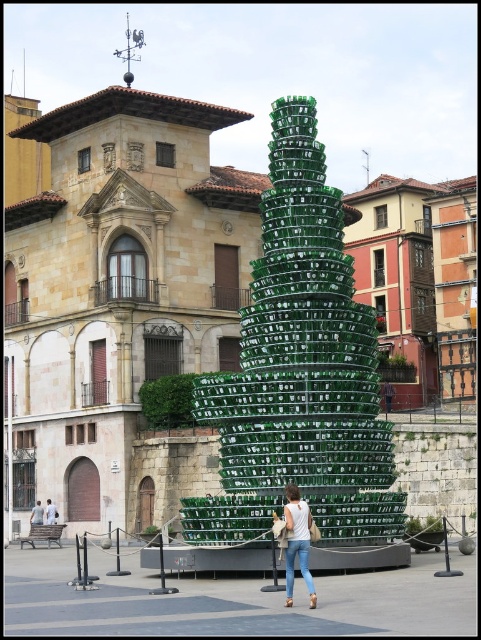
Does point (300, 540) lie in front of point (54, 508)?

Yes.

Which is behind, point (287, 484) or point (37, 500)?

The point (37, 500) is behind.

What do you see at coordinates (296, 541) in the screenshot? I see `white denim jeans at lower center` at bounding box center [296, 541].

What are the coordinates of `white denim jeans at lower center` in the screenshot? It's located at (296, 541).

Which of these two, green glass christmas tree at center or white cotton shirts at center, stands taller?

green glass christmas tree at center is taller.

Who is positioned more to the left, green glass christmas tree at center or white cotton shirts at center?

white cotton shirts at center

Describe the element at coordinates (299, 371) in the screenshot. The height and width of the screenshot is (640, 481). I see `green glass christmas tree at center` at that location.

This screenshot has width=481, height=640. Find the location of `green glass christmas tree at center`. green glass christmas tree at center is located at coordinates (299, 371).

Does point (368, 356) come in front of point (295, 554)?

That is False.

In the scene shown: Between green glass christmas tree at center and white denim jeans at lower center, which one appears on the right side from the viewer's perspective?

white denim jeans at lower center

Between point (250, 490) and point (295, 509), which one is positioned in front?

Point (295, 509) is in front.

I want to click on green glass christmas tree at center, so click(x=299, y=371).